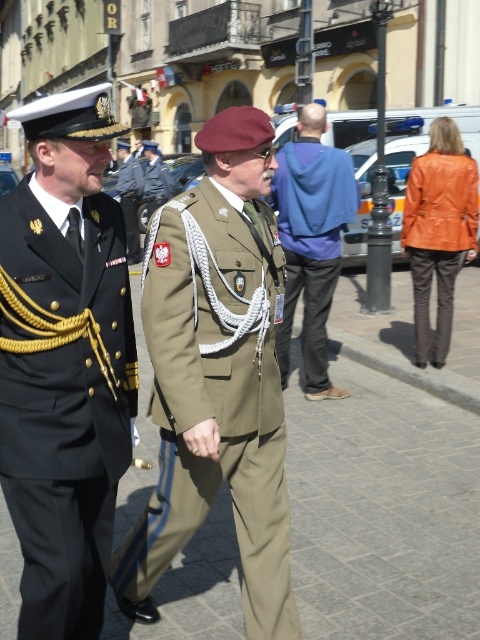
Find the location of a particular element. black satin military uniform at left is located at coordinates (63, 403).

From the picture: Between black satin military uniform at left and blue fleece at center, which one appears on the left side from the viewer's perspective?

black satin military uniform at left is more to the left.

Where is `black satin military uniform at left`? black satin military uniform at left is located at coordinates (63, 403).

Identify the location of black satin military uniform at left. The height and width of the screenshot is (640, 480). (63, 403).

Measure the distance between olive green fabric uniform at center and camera.

olive green fabric uniform at center is 7.88 feet away from camera.

Can you confirm if olive green fabric uniform at center is shorter than khaki fabric uniform at center?

No.

Identify the location of olive green fabric uniform at center. The width and height of the screenshot is (480, 640). (216, 392).

At what (x,y) coordinates should I click in order to perform the action: click on olive green fabric uniform at center. Please return your answer as a coordinate pair (x, y). Looking at the image, I should click on (216, 392).

Can you confirm if black satin military uniform at left is wider than orange leather jacket at right?

No.

Between point (111, 220) and point (453, 150), which one is positioned in front?

Point (111, 220) is in front.

At what (x,y) coordinates should I click in order to perform the action: click on black satin military uniform at left. Please return your answer as a coordinate pair (x, y). The width and height of the screenshot is (480, 640). Looking at the image, I should click on (63, 403).